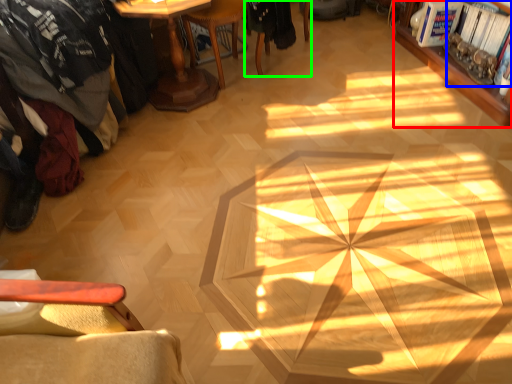
Question: Estimate the real-world distances between objects in this image. Which object is farther from bookcase (highlighted by a red box), magazine (highlighted by a blue box) or chair (highlighted by a green box)?

Choices:
 (A) magazine
 (B) chair

Answer: (B)